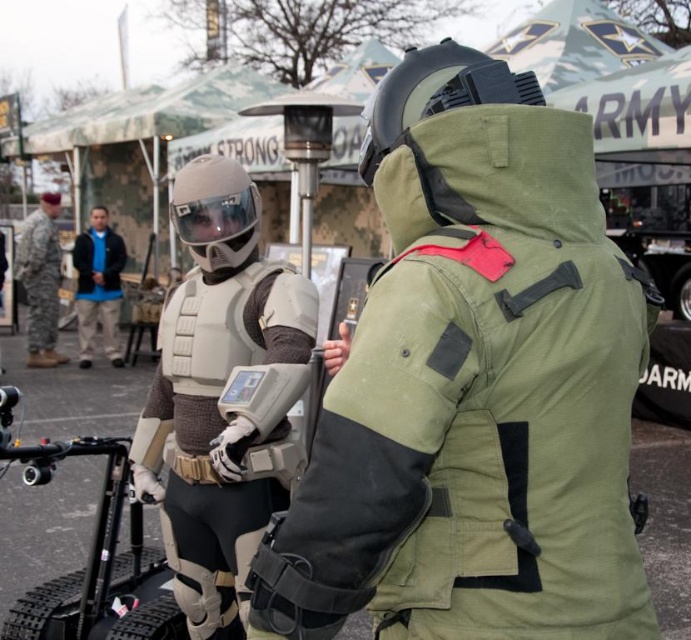
Question: Is olive green fabric jacket at center wider than matte gray armor at center?

Choices:
 (A) no
 (B) yes

Answer: (B)

Question: Which is nearer to the matte gray armor at center?

Choices:
 (A) clear plastic goggles at center
 (B) camouflage uniform at left
 (C) black matte helmet at upper center

Answer: (A)

Question: Which point appears farthest from the camera in this image?

Choices:
 (A) (435, 88)
 (B) (527, 358)
 (C) (0, 356)
 (D) (305, 348)

Answer: (C)

Question: Does black matte helmet at upper center have a larger size compared to blue fleece jacket at center?

Choices:
 (A) yes
 (B) no

Answer: (B)

Question: Does matte white helmet at center have a smaller size compared to blue fleece jacket at center?

Choices:
 (A) no
 (B) yes

Answer: (B)

Question: Which point is closer to the camera taking this photo?

Choices:
 (A) (486, 422)
 (B) (193, 380)
 (C) (236, 212)
 (D) (482, 60)

Answer: (A)